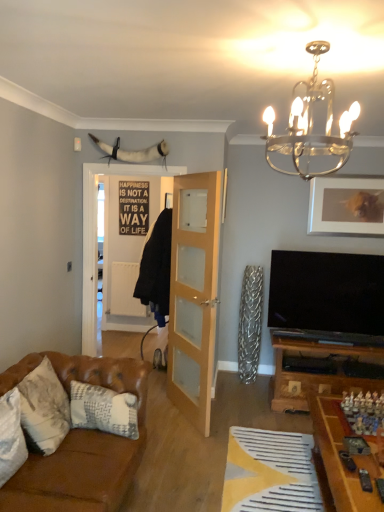
Question: From the image's perspective, is white textured pillow at lower left, the 3th pillow when ordered from back to front, beneath clear glass door at center?

Choices:
 (A) yes
 (B) no

Answer: (A)

Question: Does white textured pillow at lower left, the 3th pillow when ordered from back to front, have a greater width compared to clear glass door at center?

Choices:
 (A) no
 (B) yes

Answer: (B)

Question: Does white textured pillow at lower left, the 3th pillow when ordered from back to front, have a larger size compared to clear glass door at center?

Choices:
 (A) no
 (B) yes

Answer: (A)

Question: Considering the relative sizes of white textured pillow at lower left, the 3th pillow when ordered from back to front, and clear glass door at center in the image provided, is white textured pillow at lower left, the 3th pillow when ordered from back to front, thinner than clear glass door at center?

Choices:
 (A) no
 (B) yes

Answer: (A)

Question: From a real-world perspective, is wooden game board at lower right positioned above or below white textured pillow at lower left, the 3th pillow when ordered from back to front?

Choices:
 (A) above
 (B) below

Answer: (B)

Question: Looking at the image, does wooden game board at lower right seem bigger or smaller compared to white textured pillow at lower left, the 3th pillow when ordered from back to front?

Choices:
 (A) small
 (B) big

Answer: (B)

Question: In terms of height, does wooden game board at lower right look taller or shorter compared to white textured pillow at lower left, which appears as the 1th pillow when viewed from the front?

Choices:
 (A) short
 (B) tall

Answer: (B)

Question: Is point (370, 476) positioned closer to the camera than point (8, 457)?

Choices:
 (A) closer
 (B) farther

Answer: (B)

Question: From the image's perspective, is yellow fabric at lower center located above or below leather couch at lower left?

Choices:
 (A) below
 (B) above

Answer: (A)

Question: From a real-world perspective, relative to leather couch at lower left, is yellow fabric at lower center vertically above or below?

Choices:
 (A) below
 (B) above

Answer: (A)

Question: Is yellow fabric at lower center in front of or behind leather couch at lower left in the image?

Choices:
 (A) behind
 (B) front

Answer: (A)

Question: Based on their sizes in the image, would you say yellow fabric at lower center is bigger or smaller than leather couch at lower left?

Choices:
 (A) big
 (B) small

Answer: (B)

Question: Considering the relative positions of yellow fabric at lower center and clear glass door at center in the image provided, is yellow fabric at lower center to the left or to the right of clear glass door at center?

Choices:
 (A) left
 (B) right

Answer: (B)

Question: Which is correct: yellow fabric at lower center is inside clear glass door at center, or outside of it?

Choices:
 (A) outside
 (B) inside

Answer: (A)